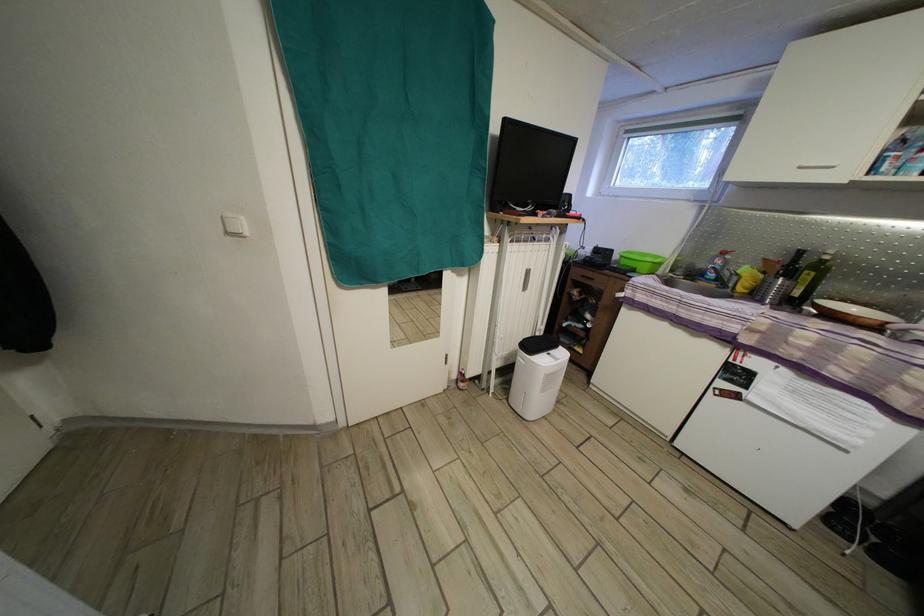
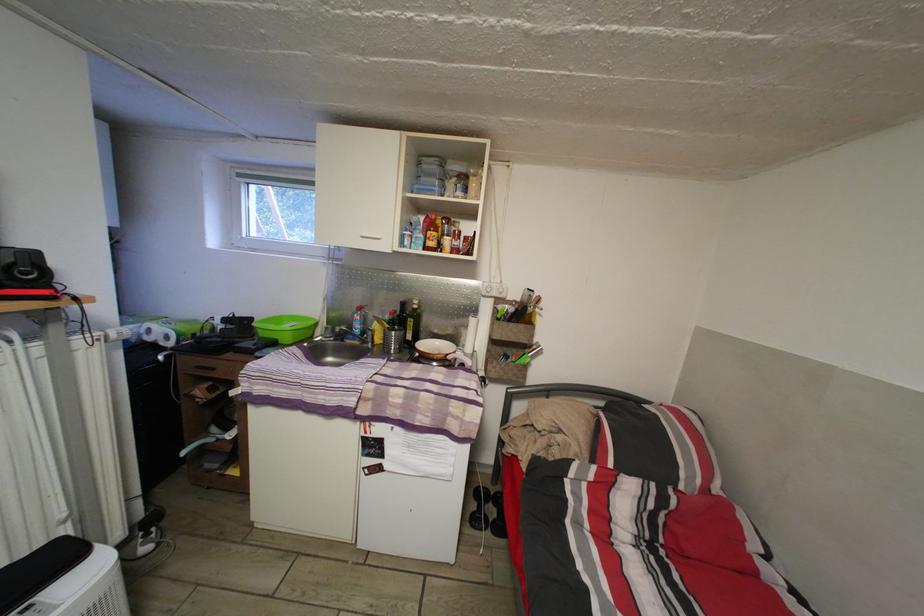
Where in the second image is the point corresponding to (618,257) from the first image?

(257, 326)